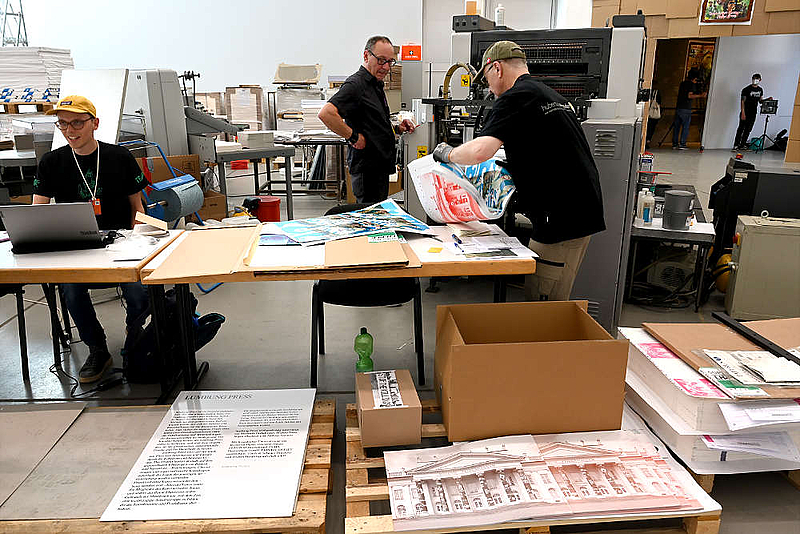
At what (x,y) coordinates should I click in order to perform the action: click on floor. Please return your answer as a coordinate pair (x, y). The image size is (800, 534). Looking at the image, I should click on (248, 339), (266, 313).